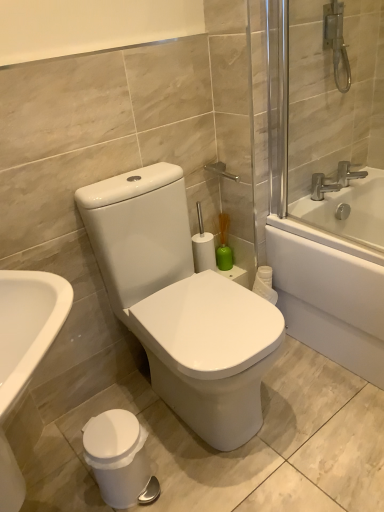
You are a GUI agent. You are given a task and a screenshot of the screen. Output one action in this format:
    pyautogui.click(x=<x>, y=<y>)
    Task: Click on the vacant space that is to the left of white plastic trash can at lower left
    This screenshot has width=384, height=512.
    Given the screenshot: What is the action you would take?
    click(68, 478)